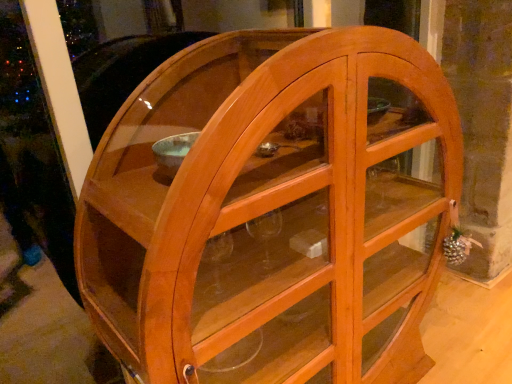
You are a GUI agent. You are given a task and a screenshot of the screen. Output one action in this format:
    pyautogui.click(x=<x>, y=<y>)
    Task: Click on the matte wood cabinet at center
    Image resolution: width=512 pixels, height=384 pixels.
    Given the screenshot: What is the action you would take?
    pyautogui.click(x=270, y=214)

The width and height of the screenshot is (512, 384). What do you see at coordinates (270, 214) in the screenshot? I see `matte wood cabinet at center` at bounding box center [270, 214].

Identify the location of matte wood cabinet at center. Image resolution: width=512 pixels, height=384 pixels. pyautogui.click(x=270, y=214).